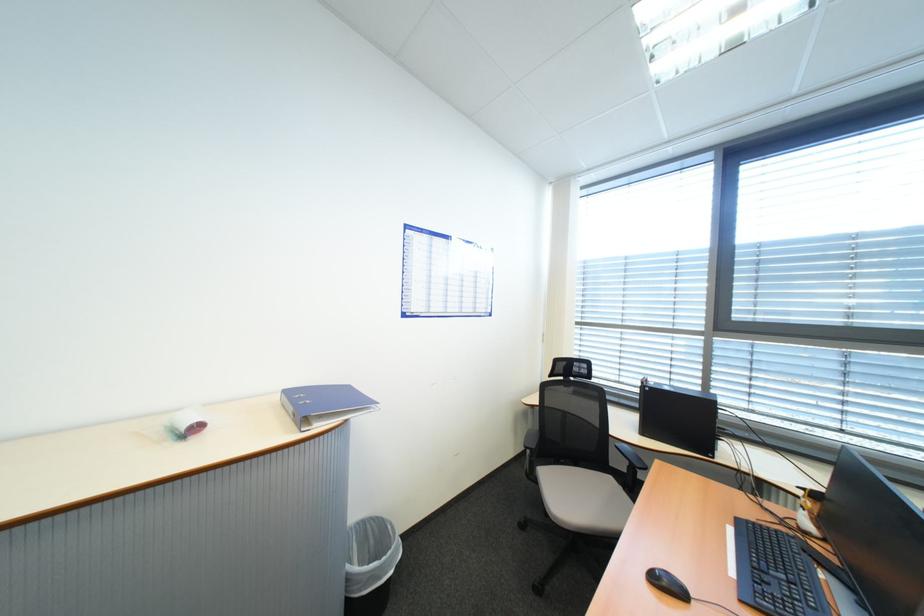
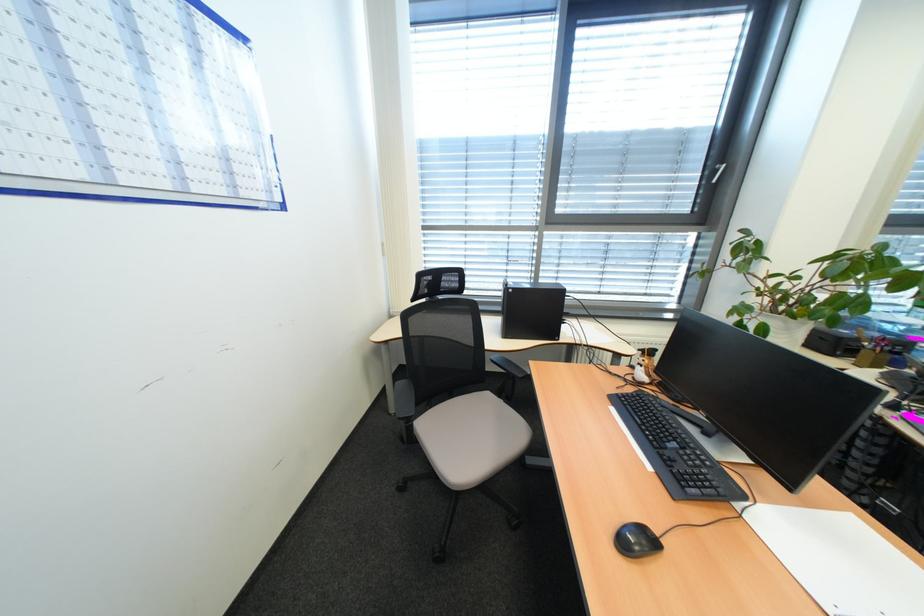
Locate, in the second image, the point that corresponds to pixel 561 514 in the first image.

(459, 485)